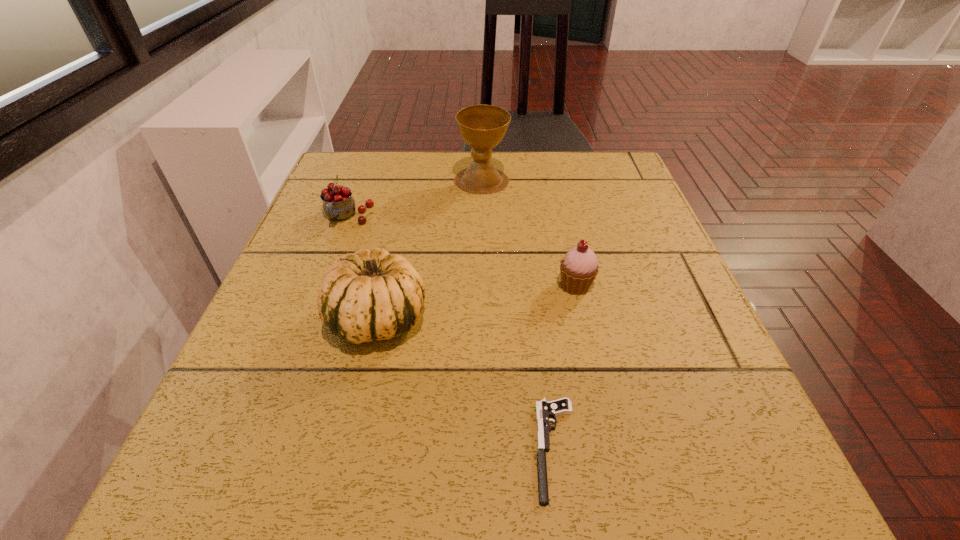
At what (x,y) coordinates should I click in order to perform the action: click on the tallest object. Please return your answer as a coordinate pair (x, y). Looking at the image, I should click on (483, 127).

The image size is (960, 540). I want to click on the third object from right to left, so (x=483, y=127).

Where is `the second tallest object`? the second tallest object is located at coordinates (373, 295).

Locate an element on the screen. The height and width of the screenshot is (540, 960). the second farthest object is located at coordinates (338, 204).

At what (x,y) coordinates should I click in order to perform the action: click on the rightmost object. Please return your answer as a coordinate pair (x, y). The width and height of the screenshot is (960, 540). Looking at the image, I should click on (579, 267).

At what (x,y) coordinates should I click in order to perform the action: click on the nearest object. Please return your answer as a coordinate pair (x, y). This screenshot has width=960, height=540. Looking at the image, I should click on (544, 409).

In order to click on the shortest object in this screenshot , I will do `click(544, 409)`.

Image resolution: width=960 pixels, height=540 pixels. I want to click on vacant region located 0.170m on the left of the farthest object, so click(386, 180).

Where is `vacant space located 0.360m on the right of the gourd`? vacant space located 0.360m on the right of the gourd is located at coordinates (636, 319).

What are the coordinates of `vacant space located 0.160m on the handle side of the second farthest object` in the screenshot? It's located at (324, 282).